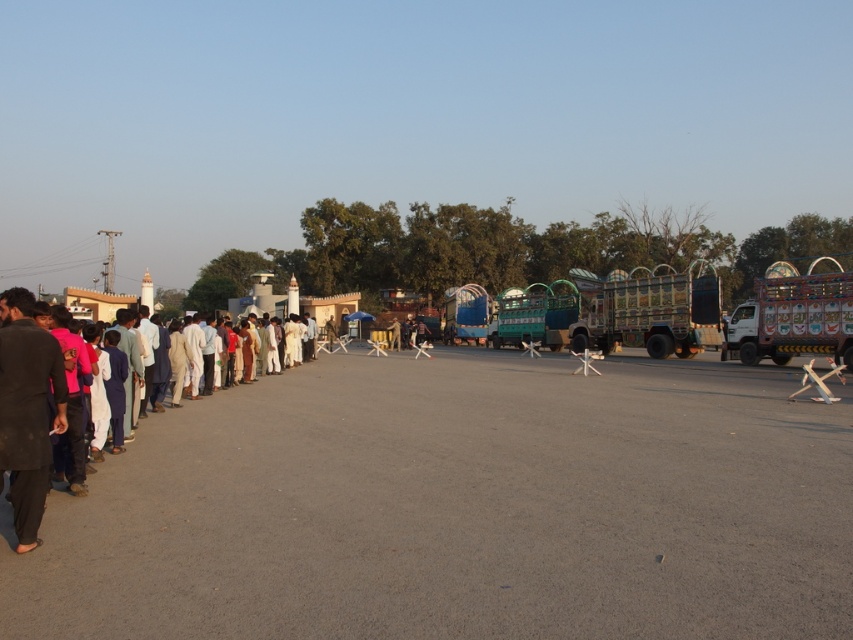
Question: Can you confirm if dark brown fabric shirt at left is positioned above dark brown fabric pants at left?

Choices:
 (A) yes
 (B) no

Answer: (B)

Question: Is dark brown fabric shirt at left wider than dark brown fabric pants at left?

Choices:
 (A) no
 (B) yes

Answer: (A)

Question: Can you confirm if dark brown fabric shirt at left is positioned to the left of dark brown fabric pants at left?

Choices:
 (A) yes
 (B) no

Answer: (B)

Question: Which point is closer to the camera?

Choices:
 (A) dark brown fabric pants at left
 (B) dark brown fabric shirt at left

Answer: (A)